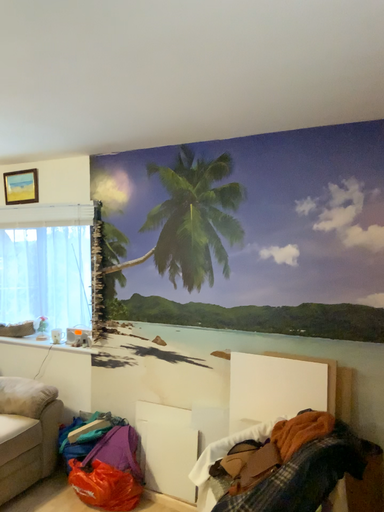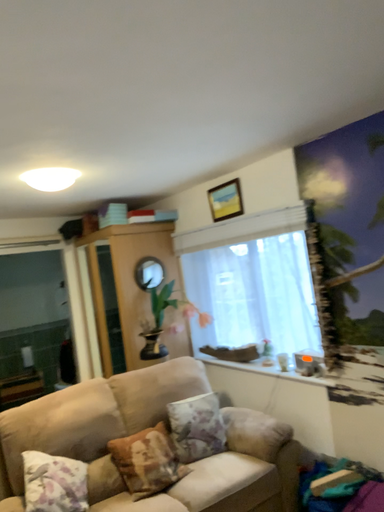
Question: Which way did the camera rotate in the video?

Choices:
 (A) rotated left
 (B) rotated right

Answer: (A)